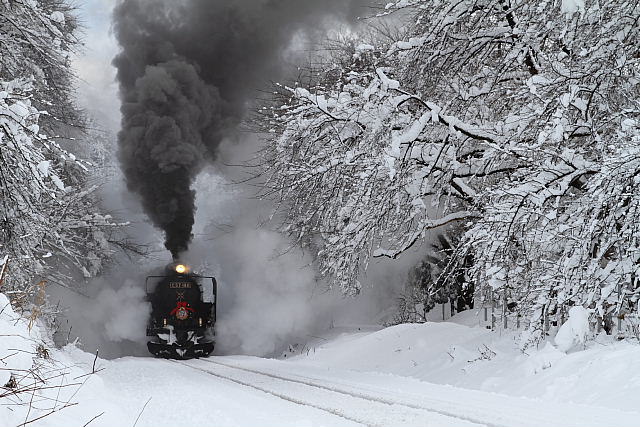
What are the coordinates of `light` in the screenshot? It's located at (180, 268).